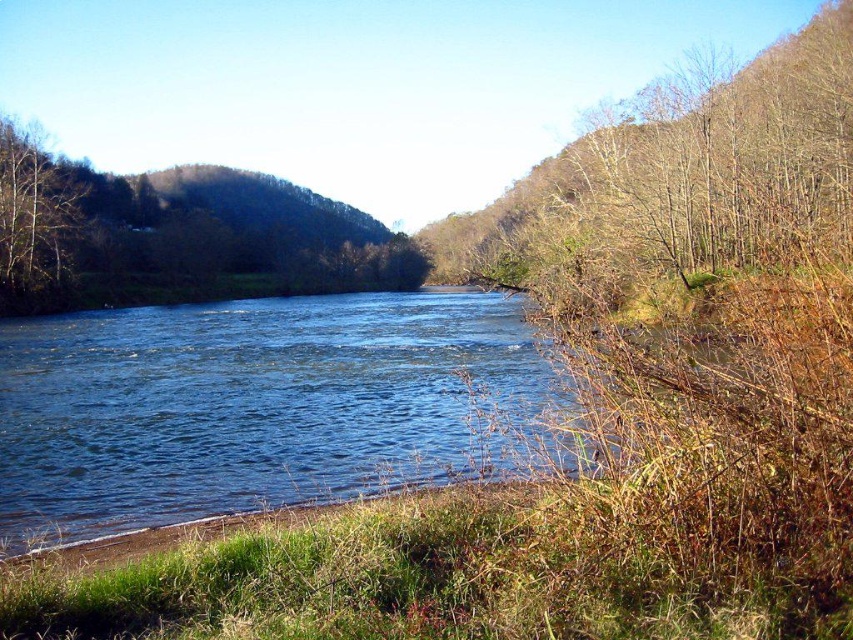
You are standing on the riverbank and see the brown leafy tree at center and the brown leafless tree at left. Which tree is closer to the right side of the river?

The brown leafy tree at center is closer to the right side of the river because it is positioned to the right of the brown leafless tree at left.